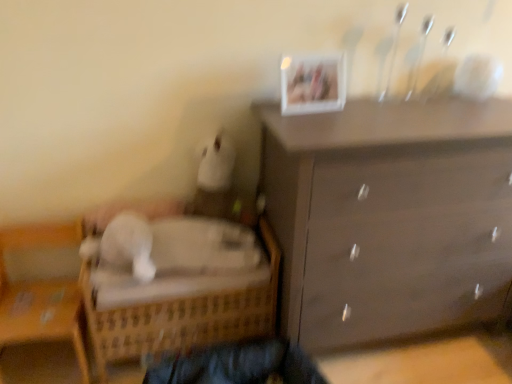
Where is `vacant space situated above matte brown dresser at upper right (from a real-world perspective)`? The width and height of the screenshot is (512, 384). vacant space situated above matte brown dresser at upper right (from a real-world perspective) is located at coordinates (435, 109).